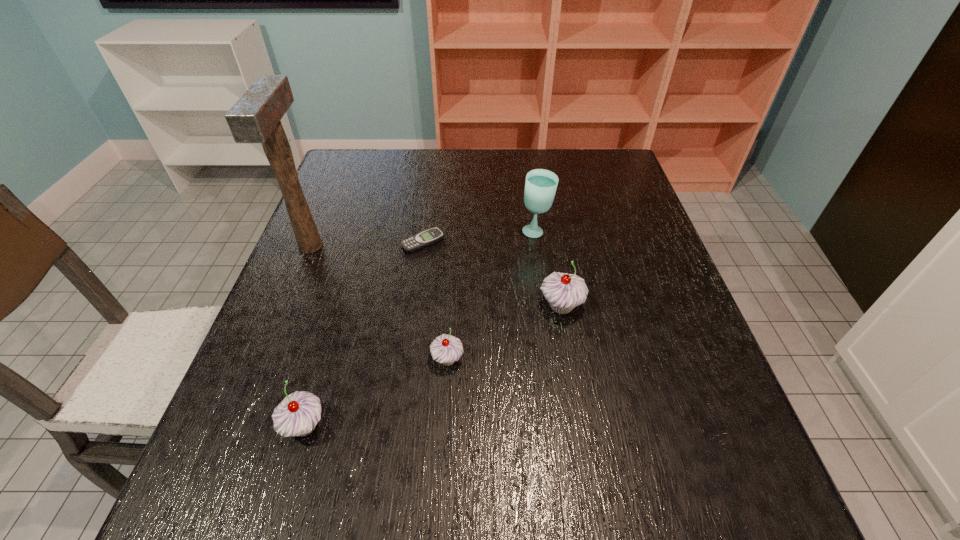
This screenshot has height=540, width=960. Identify the location of the nearest cupcake. (297, 415).

Find the location of `the second tallest cupcake`. the second tallest cupcake is located at coordinates (297, 415).

The height and width of the screenshot is (540, 960). I want to click on the second nearest object, so click(446, 349).

Locate an element on the screen. the shortest cupcake is located at coordinates (446, 349).

Find the location of a particular element. The width and height of the screenshot is (960, 540). the rightmost cupcake is located at coordinates (563, 291).

Where is `the farthest cupcake`? The height and width of the screenshot is (540, 960). the farthest cupcake is located at coordinates (563, 291).

Locate an element on the screen. The width and height of the screenshot is (960, 540). the shortest object is located at coordinates (430, 236).

Identify the location of glass. (540, 187).

Image resolution: width=960 pixels, height=540 pixels. Find the location of `the tallest object`. the tallest object is located at coordinates (255, 118).

Find the location of a particular element. The width and height of the screenshot is (960, 540). mallet is located at coordinates (255, 118).